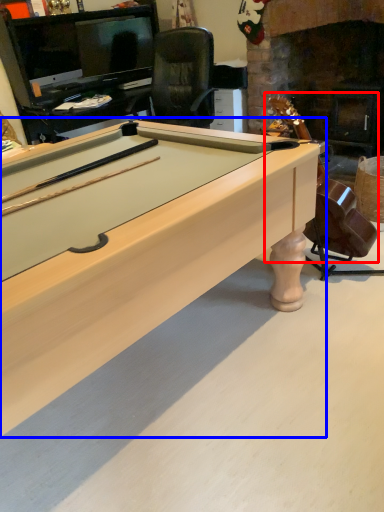
Question: Which of the following is the farthest to the observer, guitar (highlighted by a red box) or billiard table (highlighted by a blue box)?

Choices:
 (A) guitar
 (B) billiard table

Answer: (A)